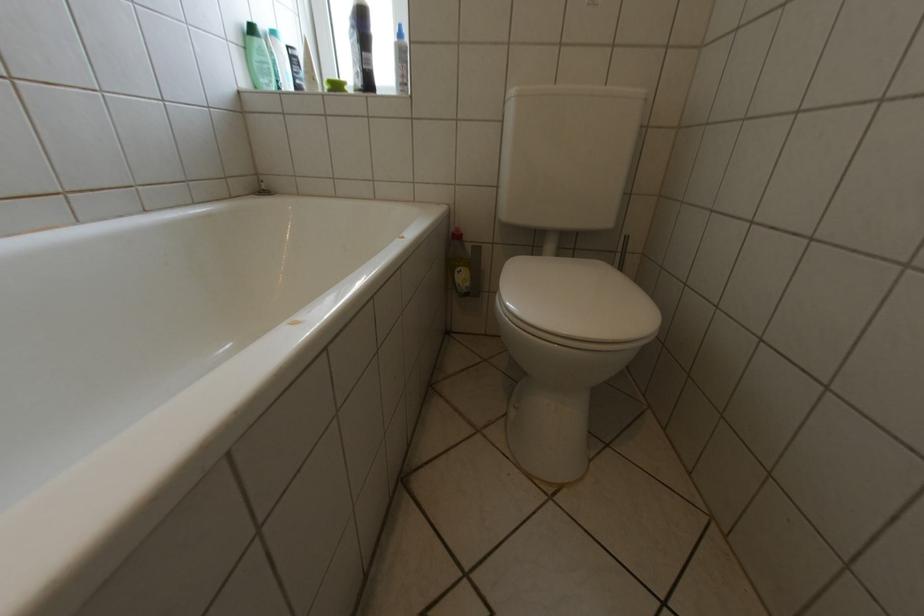
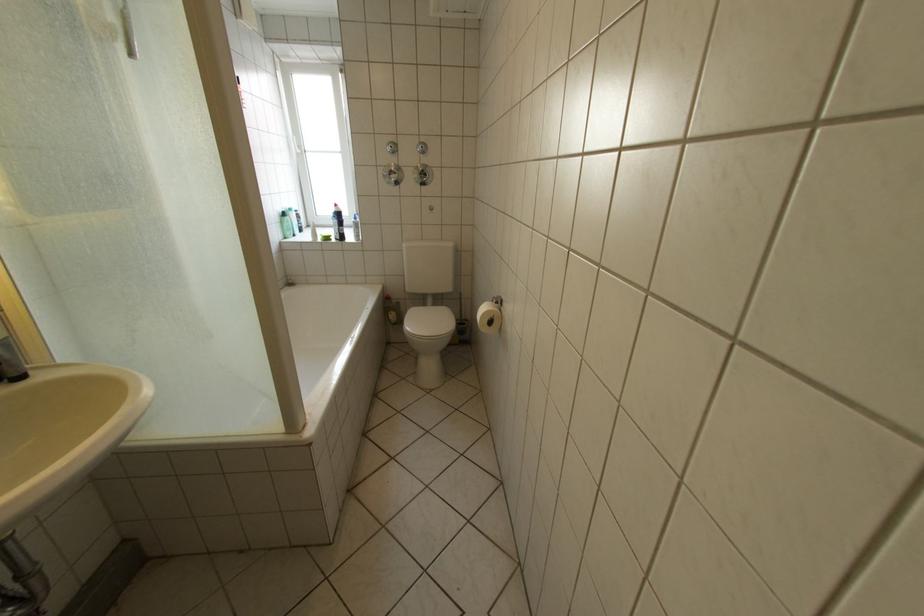
In the second image, find the point that corresponds to pixel 359 90 in the first image.

(344, 238)